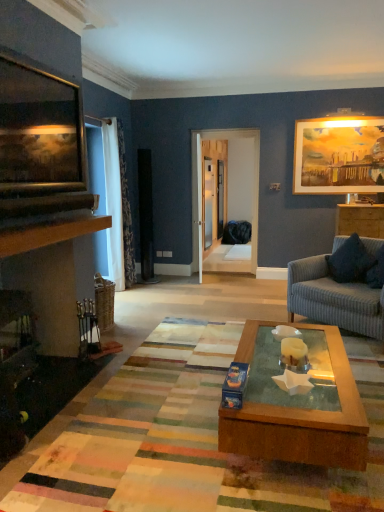
Question: Is wooden picture frame at upper left, the 2th picture frame when ordered from back to front, outside of striped fabric couch at right?

Choices:
 (A) no
 (B) yes

Answer: (B)

Question: Can you confirm if wooden picture frame at upper left, the first picture frame in the front-to-back sequence, is shorter than striped fabric couch at right?

Choices:
 (A) no
 (B) yes

Answer: (B)

Question: Is wooden picture frame at upper left, the first picture frame in the front-to-back sequence, positioned in front of striped fabric couch at right?

Choices:
 (A) yes
 (B) no

Answer: (A)

Question: Is wooden picture frame at upper left, the first picture frame in the front-to-back sequence, bigger than striped fabric couch at right?

Choices:
 (A) no
 (B) yes

Answer: (A)

Question: Does wooden picture frame at upper left, the 2th picture frame when ordered from back to front, come behind striped fabric couch at right?

Choices:
 (A) no
 (B) yes

Answer: (A)

Question: Does wooden picture frame at upper left, the 2th picture frame when ordered from back to front, have a greater height compared to striped fabric couch at right?

Choices:
 (A) yes
 (B) no

Answer: (B)

Question: Does wooden cabinet at right come in front of white floral fabric curtain at left?

Choices:
 (A) no
 (B) yes

Answer: (A)

Question: Is wooden cabinet at right not within white floral fabric curtain at left?

Choices:
 (A) yes
 (B) no

Answer: (A)

Question: Is wooden cabinet at right at the left side of white floral fabric curtain at left?

Choices:
 (A) no
 (B) yes

Answer: (A)

Question: Would you consider wooden cabinet at right to be distant from white floral fabric curtain at left?

Choices:
 (A) no
 (B) yes

Answer: (B)

Question: Does wooden cabinet at right contain white floral fabric curtain at left?

Choices:
 (A) no
 (B) yes

Answer: (A)

Question: Can you confirm if wooden cabinet at right is taller than white floral fabric curtain at left?

Choices:
 (A) yes
 (B) no

Answer: (B)

Question: Does white floral fabric curtain at left come behind multicolored woven mat at center?

Choices:
 (A) yes
 (B) no

Answer: (A)